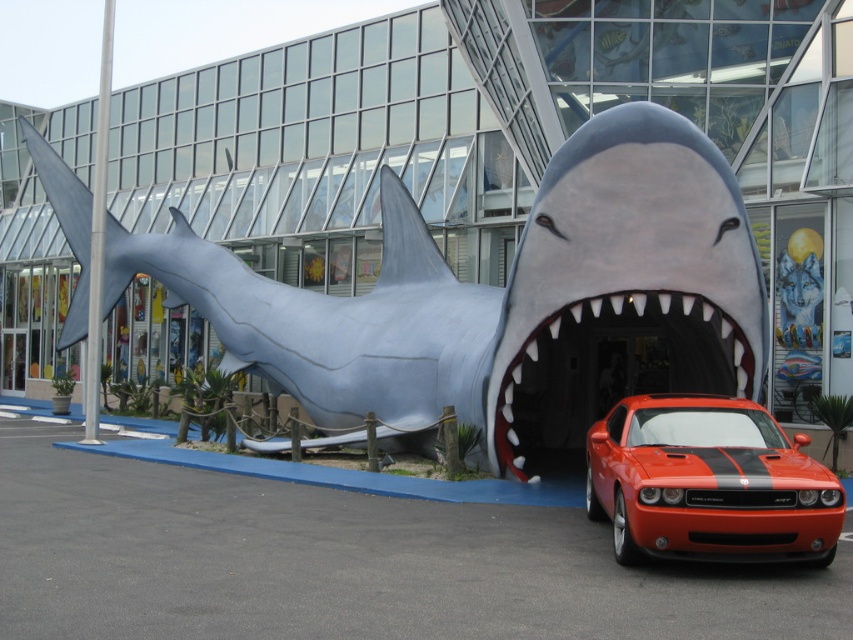
Can you confirm if gray matte shark at center is positioned to the right of white teeth plastic mouth at center?

In fact, gray matte shark at center is to the left of white teeth plastic mouth at center.

Is point (436, 280) closer to camera compared to point (636, 304)?

That is False.

Where is `gray matte shark at center`? The width and height of the screenshot is (853, 640). gray matte shark at center is located at coordinates (492, 289).

Does orange glossy car at center appear over white teeth plastic mouth at center?

Correct, orange glossy car at center is located above white teeth plastic mouth at center.

Which is behind, point (688, 534) or point (558, 435)?

Positioned behind is point (558, 435).

Is point (822, 540) closer to camera compared to point (560, 448)?

Yes.

This screenshot has width=853, height=640. What are the coordinates of `orange glossy car at center` in the screenshot? It's located at (708, 483).

Which of these two, gray matte shark at center or orange glossy car at center, stands shorter?

Standing shorter between the two is orange glossy car at center.

From the picture: How far apart are gray matte shark at center and orange glossy car at center?

gray matte shark at center is 13.96 feet from orange glossy car at center.

Which is behind, point (445, 292) or point (672, 433)?

The point (445, 292) is more distant.

Identify the location of gray matte shark at center. (492, 289).